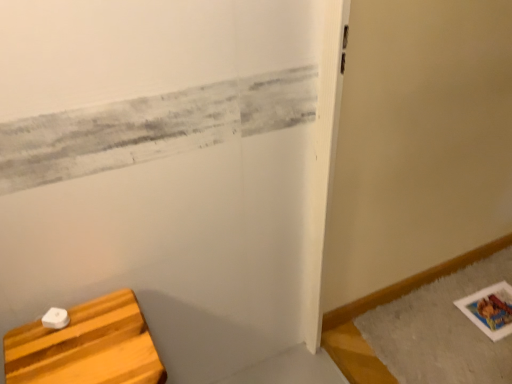
Question: Can we say white matte wood cutting board at lower left lies outside gray fluffy bath mat at lower right?

Choices:
 (A) no
 (B) yes

Answer: (B)

Question: Does white matte wood cutting board at lower left appear on the left side of gray fluffy bath mat at lower right?

Choices:
 (A) yes
 (B) no

Answer: (A)

Question: Is gray fluffy bath mat at lower right surrounded by white matte wood cutting board at lower left?

Choices:
 (A) yes
 (B) no

Answer: (B)

Question: Is white matte wood cutting board at lower left directly adjacent to gray fluffy bath mat at lower right?

Choices:
 (A) no
 (B) yes

Answer: (A)

Question: Is white matte wood cutting board at lower left bigger than gray fluffy bath mat at lower right?

Choices:
 (A) yes
 (B) no

Answer: (A)

Question: Is white matte wood cutting board at lower left to the right of gray fluffy bath mat at lower right from the viewer's perspective?

Choices:
 (A) yes
 (B) no

Answer: (B)

Question: Considering the relative positions of gray fluffy bath mat at lower right and white matte wood cutting board at lower left in the image provided, is gray fluffy bath mat at lower right to the left of white matte wood cutting board at lower left from the viewer's perspective?

Choices:
 (A) yes
 (B) no

Answer: (B)

Question: Does gray fluffy bath mat at lower right appear on the right side of white matte wood cutting board at lower left?

Choices:
 (A) no
 (B) yes

Answer: (B)

Question: Does gray fluffy bath mat at lower right turn towards white matte wood cutting board at lower left?

Choices:
 (A) yes
 (B) no

Answer: (B)

Question: Does gray fluffy bath mat at lower right have a lesser height compared to white matte wood cutting board at lower left?

Choices:
 (A) yes
 (B) no

Answer: (A)

Question: From the image's perspective, is gray fluffy bath mat at lower right below white matte wood cutting board at lower left?

Choices:
 (A) no
 (B) yes

Answer: (A)

Question: From a real-world perspective, is gray fluffy bath mat at lower right physically above white matte wood cutting board at lower left?

Choices:
 (A) no
 (B) yes

Answer: (A)

Question: From their relative heights in the image, would you say gray fluffy bath mat at lower right is taller or shorter than white matte wood cutting board at lower left?

Choices:
 (A) short
 (B) tall

Answer: (A)